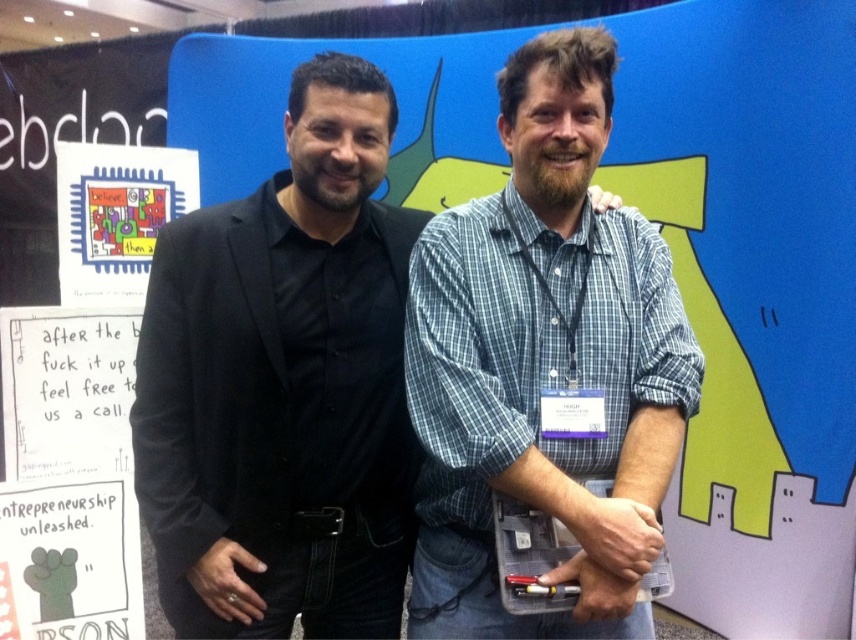
Question: Which point is closer to the camera?

Choices:
 (A) (324, 125)
 (B) (516, 186)

Answer: (A)

Question: Can you confirm if black matte suit at left is bigger than blue plaid shirt at center?

Choices:
 (A) no
 (B) yes

Answer: (B)

Question: Is black matte suit at left further to camera compared to blue plaid shirt at center?

Choices:
 (A) yes
 (B) no

Answer: (A)

Question: Does black matte suit at left have a lesser width compared to blue plaid shirt at center?

Choices:
 (A) yes
 (B) no

Answer: (B)